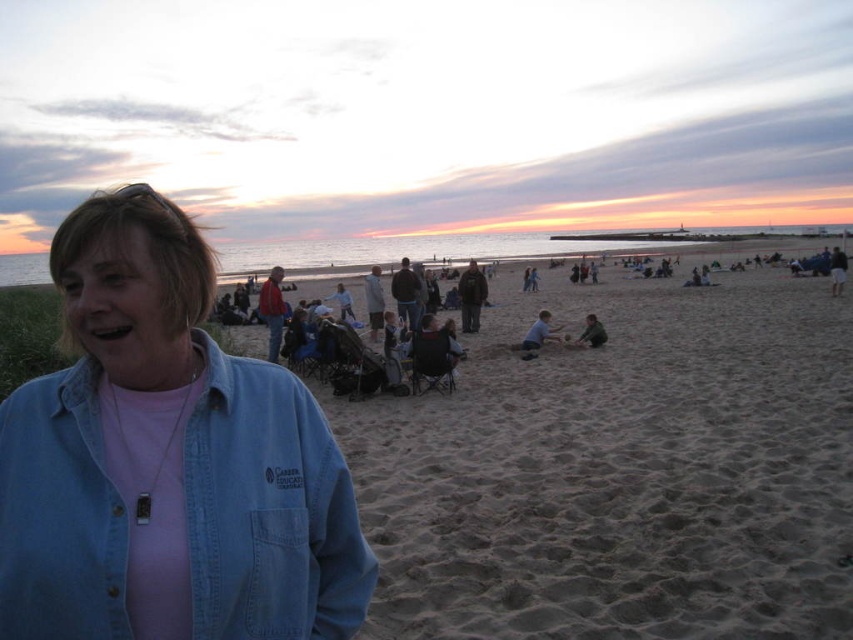
You are standing on the beach and want to place a small seashell on the light brown sand at center and the smooth sand at lower center. Which area would allow the seashell to be more visible against the sand?

The light brown sand at center is bigger than smooth sand at lower center, so placing the seashell on the smooth sand at lower center would make it more visible because the smaller grains of the smooth sand provide a better contrast against the seashell.

You are standing on the beach and want to place a small flag exactly at the point marked as point (619, 468). According to the scene description, where should you place the flag?

The point (619, 468) is on light brown sand at center, so you should place the flag on the light brown sand at center.

You are a photographer trying to capture a photo of the dark gray pants at right and the dark gray fabric child at center in the beach scene. Which object is positioned higher in the frame?

The dark gray pants at right is above the dark gray fabric child at center in the frame.